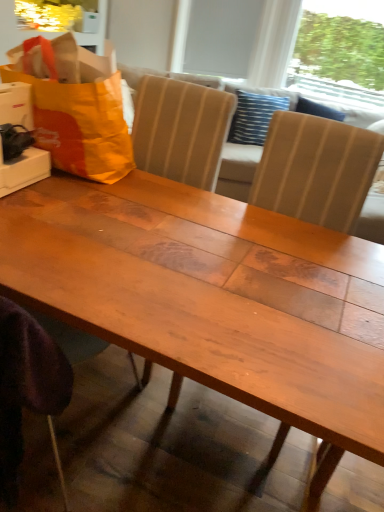
Question: Is transparent plastic window screen at upper right, which is counted as the 2th window screen, starting from the left, far from blue striped pillow at upper center?

Choices:
 (A) yes
 (B) no

Answer: (A)

Question: Could you tell me if transparent plastic window screen at upper right, which ranks as the first window screen in right-to-left order, is facing blue striped pillow at upper center?

Choices:
 (A) yes
 (B) no

Answer: (A)

Question: Does transparent plastic window screen at upper right, which is counted as the 2th window screen, starting from the left, appear on the left side of blue striped pillow at upper center?

Choices:
 (A) yes
 (B) no

Answer: (B)

Question: Is transparent plastic window screen at upper right, which is counted as the 2th window screen, starting from the left, turned away from blue striped pillow at upper center?

Choices:
 (A) no
 (B) yes

Answer: (A)

Question: Can you confirm if transparent plastic window screen at upper right, which ranks as the first window screen in right-to-left order, is taller than blue striped pillow at upper center?

Choices:
 (A) yes
 (B) no

Answer: (A)

Question: From the image's perspective, would you say transparent plastic window screen at upper right, which is counted as the 2th window screen, starting from the left, is shown under blue striped pillow at upper center?

Choices:
 (A) yes
 (B) no

Answer: (B)

Question: Is transparent plastic window screen at upper right, which ranks as the first window screen in right-to-left order, taller than wooden table at center?

Choices:
 (A) no
 (B) yes

Answer: (B)

Question: Is transparent plastic window screen at upper right, which ranks as the first window screen in right-to-left order, smaller than wooden table at center?

Choices:
 (A) no
 (B) yes

Answer: (A)

Question: Does transparent plastic window screen at upper right, which is counted as the 2th window screen, starting from the left, have a lesser height compared to wooden table at center?

Choices:
 (A) no
 (B) yes

Answer: (A)

Question: Does transparent plastic window screen at upper right, which is counted as the 2th window screen, starting from the left, come in front of wooden table at center?

Choices:
 (A) no
 (B) yes

Answer: (A)

Question: Are transparent plastic window screen at upper right, which is counted as the 2th window screen, starting from the left, and wooden table at center located far from each other?

Choices:
 (A) yes
 (B) no

Answer: (A)

Question: Can you confirm if transparent plastic window screen at upper right, which is counted as the 2th window screen, starting from the left, is bigger than wooden table at center?

Choices:
 (A) no
 (B) yes

Answer: (B)

Question: Are orange fabric grocery bag at upper left and white matte window screen at upper center, which is the second window screen in right-to-left order, located far from each other?

Choices:
 (A) no
 (B) yes

Answer: (B)